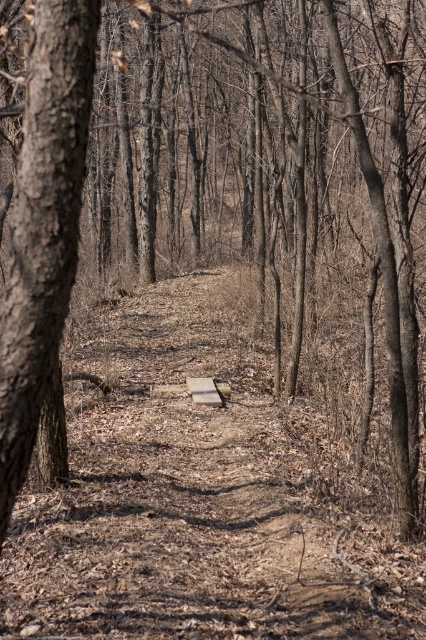
Question: Which of the following is the closest to the observer?

Choices:
 (A) wooden bench at center
 (B) rough bark tree at left

Answer: (B)

Question: Which object appears farthest from the camera in this image?

Choices:
 (A) rough bark tree at left
 (B) wooden bench at center

Answer: (B)

Question: Is rough bark tree at left positioned at the back of wooden bench at center?

Choices:
 (A) yes
 (B) no

Answer: (B)

Question: From the image, what is the correct spatial relationship of rough bark tree at left in relation to wooden bench at center?

Choices:
 (A) right
 (B) left

Answer: (B)

Question: Is rough bark tree at left to the right of wooden bench at center from the viewer's perspective?

Choices:
 (A) no
 (B) yes

Answer: (A)